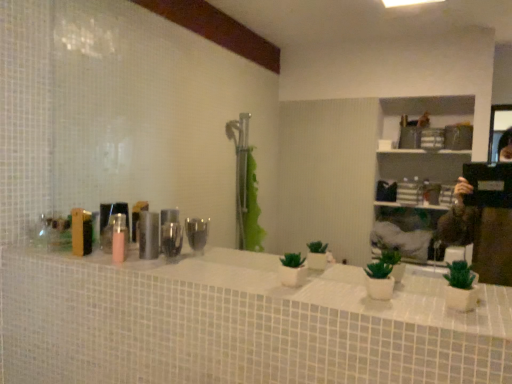
Question: Is the depth of wooden box at left, arranged as the second toiletry when viewed from the right, less than that of white glossy counter top at center?

Choices:
 (A) no
 (B) yes

Answer: (A)

Question: Can you confirm if wooden box at left, the first toiletry when ordered from left to right, is positioned to the left of white glossy counter top at center?

Choices:
 (A) yes
 (B) no

Answer: (A)

Question: Is the position of wooden box at left, the first toiletry when ordered from left to right, more distant than that of white glossy counter top at center?

Choices:
 (A) no
 (B) yes

Answer: (B)

Question: Does wooden box at left, the first toiletry when ordered from left to right, have a smaller size compared to white glossy counter top at center?

Choices:
 (A) no
 (B) yes

Answer: (B)

Question: Is wooden box at left, arranged as the second toiletry when viewed from the right, not inside white glossy counter top at center?

Choices:
 (A) no
 (B) yes

Answer: (B)

Question: From a real-world perspective, is white glossy counter top at center above or below wooden box at left, the first toiletry when ordered from left to right?

Choices:
 (A) below
 (B) above

Answer: (A)

Question: Looking at the image, does white glossy counter top at center seem bigger or smaller compared to wooden box at left, arranged as the second toiletry when viewed from the right?

Choices:
 (A) small
 (B) big

Answer: (B)

Question: Considering the positions of white glossy counter top at center and wooden box at left, the first toiletry when ordered from left to right, in the image, is white glossy counter top at center taller or shorter than wooden box at left, the first toiletry when ordered from left to right,?

Choices:
 (A) short
 (B) tall

Answer: (A)

Question: Is point (70, 254) positioned closer to the camera than point (84, 223)?

Choices:
 (A) closer
 (B) farther

Answer: (A)

Question: Considering the positions of metallic cylindrical container at center, the 2th toiletry positioned from the left, and white glossy counter top at center in the image, is metallic cylindrical container at center, the 2th toiletry positioned from the left, bigger or smaller than white glossy counter top at center?

Choices:
 (A) big
 (B) small

Answer: (B)

Question: Considering the relative positions of metallic cylindrical container at center, which is the first toiletry in right-to-left order, and white glossy counter top at center in the image provided, is metallic cylindrical container at center, which is the first toiletry in right-to-left order, to the left or to the right of white glossy counter top at center?

Choices:
 (A) left
 (B) right

Answer: (A)

Question: Considering the positions of metallic cylindrical container at center, the 2th toiletry positioned from the left, and white glossy counter top at center in the image, is metallic cylindrical container at center, the 2th toiletry positioned from the left, taller or shorter than white glossy counter top at center?

Choices:
 (A) short
 (B) tall

Answer: (B)

Question: Is metallic cylindrical container at center, the 2th toiletry positioned from the left, in front of or behind white glossy counter top at center in the image?

Choices:
 (A) front
 (B) behind

Answer: (B)

Question: Considering the positions of wooden box at left, the first toiletry when ordered from left to right, and white glossy counter top at center in the image, is wooden box at left, the first toiletry when ordered from left to right, wider or thinner than white glossy counter top at center?

Choices:
 (A) thin
 (B) wide

Answer: (A)

Question: Considering the positions of wooden box at left, arranged as the second toiletry when viewed from the right, and white glossy counter top at center in the image, is wooden box at left, arranged as the second toiletry when viewed from the right, bigger or smaller than white glossy counter top at center?

Choices:
 (A) small
 (B) big

Answer: (A)